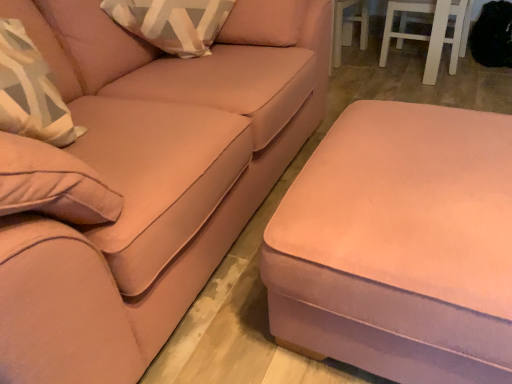
Find the location of a particular element. matte pink ottoman at lower right is located at coordinates (153, 178).

The image size is (512, 384). Describe the element at coordinates (153, 178) in the screenshot. I see `matte pink ottoman at lower right` at that location.

Measure the distance between point (469, 231) and camera.

Point (469, 231) and camera are 34.29 inches apart.

The image size is (512, 384). What do you see at coordinates (400, 245) in the screenshot? I see `matte pink ottoman at lower right` at bounding box center [400, 245].

You are a GUI agent. You are given a task and a screenshot of the screen. Output one action in this format:
    pyautogui.click(x=<x>, y=<y>)
    Task: Click on the matte pink ottoman at lower right
    
    Given the screenshot: What is the action you would take?
    point(400,245)

I want to click on matte pink ottoman at lower right, so click(153, 178).

Between matte pink ottoman at lower right and matte pink ottoman at lower right, which one appears on the left side from the viewer's perspective?

From the viewer's perspective, matte pink ottoman at lower right appears more on the left side.

Considering the positions of objects matte pink ottoman at lower right and matte pink ottoman at lower right in the image provided, who is in front, matte pink ottoman at lower right or matte pink ottoman at lower right?

matte pink ottoman at lower right is closer to the camera.

Is point (479, 252) positioned behind point (123, 301)?

No, it is not.

From the image's perspective, which is below, matte pink ottoman at lower right or matte pink ottoman at lower right?

matte pink ottoman at lower right is shown below in the image.

From a real-world perspective, is matte pink ottoman at lower right above or below matte pink ottoman at lower right?

Clearly, from a real-world perspective, matte pink ottoman at lower right is below matte pink ottoman at lower right.

Does matte pink ottoman at lower right have a greater width compared to matte pink ottoman at lower right?

In fact, matte pink ottoman at lower right might be narrower than matte pink ottoman at lower right.

Can you confirm if matte pink ottoman at lower right is taller than matte pink ottoman at lower right?

In fact, matte pink ottoman at lower right may be shorter than matte pink ottoman at lower right.

In the scene shown: In terms of size, does matte pink ottoman at lower right appear bigger or smaller than matte pink ottoman at lower right?

matte pink ottoman at lower right is smaller than matte pink ottoman at lower right.

Is matte pink ottoman at lower right surrounded by matte pink ottoman at lower right?

No.

Is matte pink ottoman at lower right touching matte pink ottoman at lower right?

No, matte pink ottoman at lower right is not with matte pink ottoman at lower right.

Is matte pink ottoman at lower right aimed at matte pink ottoman at lower right?

No.

What's the angular difference between matte pink ottoman at lower right and matte pink ottoman at lower right's facing directions?

0.00126 degrees.

Locate an element on the screen. The image size is (512, 384). studio couch above the matte pink ottoman at lower right (from the image's perspective) is located at coordinates (153, 178).

Which is more to the right, matte pink ottoman at lower right or matte pink ottoman at lower right?

matte pink ottoman at lower right.

Looking at this image, considering the positions of objects matte pink ottoman at lower right and matte pink ottoman at lower right in the image provided, who is behind, matte pink ottoman at lower right or matte pink ottoman at lower right?

matte pink ottoman at lower right is further from the camera.

Between point (222, 111) and point (353, 264), which one is positioned behind?

Positioned behind is point (222, 111).

From the image's perspective, which is below, matte pink ottoman at lower right or matte pink ottoman at lower right?

From the image's view, matte pink ottoman at lower right is below.

From a real-world perspective, which is physically below, matte pink ottoman at lower right or matte pink ottoman at lower right?

From a 3D spatial view, matte pink ottoman at lower right is below.

Can you confirm if matte pink ottoman at lower right is thinner than matte pink ottoman at lower right?

No, matte pink ottoman at lower right is not thinner than matte pink ottoman at lower right.

Which of these two, matte pink ottoman at lower right or matte pink ottoman at lower right, stands shorter?

Standing shorter between the two is matte pink ottoman at lower right.

Does matte pink ottoman at lower right have a larger size compared to matte pink ottoman at lower right?

Indeed, matte pink ottoman at lower right has a larger size compared to matte pink ottoman at lower right.

Is matte pink ottoman at lower right completely or partially inside matte pink ottoman at lower right?

Definitely not — matte pink ottoman at lower right is not inside matte pink ottoman at lower right.

Is matte pink ottoman at lower right touching matte pink ottoman at lower right?

No, matte pink ottoman at lower right is not beside matte pink ottoman at lower right.

Is matte pink ottoman at lower right turned away from matte pink ottoman at lower right?

No, matte pink ottoman at lower right's orientation is not away from matte pink ottoman at lower right.

I want to click on studio couch located on the left of matte pink ottoman at lower right, so click(153, 178).

I want to click on studio couch above the matte pink ottoman at lower right (from the image's perspective), so point(153,178).

The height and width of the screenshot is (384, 512). What are the coordinates of `studio couch in front of the matte pink ottoman at lower right` in the screenshot? It's located at (153, 178).